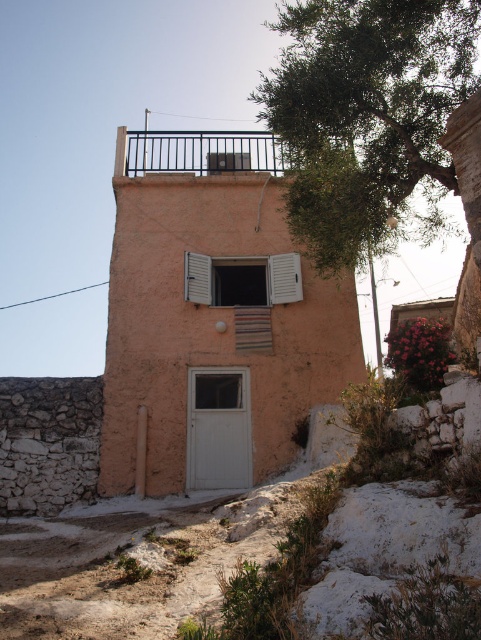
What do you see at coordinates (367, 115) in the screenshot? I see `green leafy tree at upper right` at bounding box center [367, 115].

Which is in front, point (339, 67) or point (237, 140)?

Point (339, 67)

Find the location of a particular element. green leafy tree at upper right is located at coordinates (367, 115).

Does white matte window at center have a smaller size compared to white matte shutter at center?

Actually, white matte window at center might be larger than white matte shutter at center.

Between white matte window at center and white matte shutter at center, which one appears on the left side from the viewer's perspective?

From the viewer's perspective, white matte shutter at center appears more on the left side.

Which is in front, point (193, 296) or point (206, 300)?

Positioned in front is point (193, 296).

Find the location of a particular element. white matte window at center is located at coordinates (242, 280).

Can you confirm if black metal railing at upper center is smaller than white matte window at center?

No.

Which is in front, point (250, 168) or point (207, 275)?

Positioned in front is point (207, 275).

This screenshot has height=640, width=481. In order to click on black metal railing at upper center in this screenshot , I will do click(202, 152).